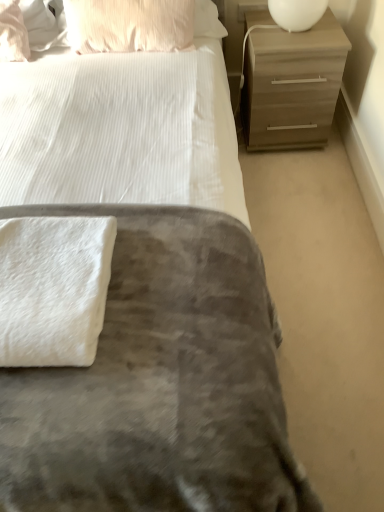
The width and height of the screenshot is (384, 512). I want to click on free point below white glossy lampshade at upper right (from a real-world perspective), so click(296, 31).